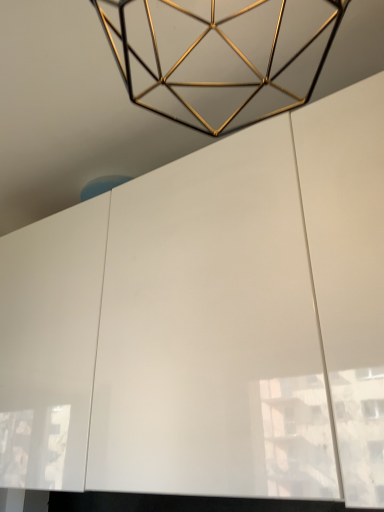
Image resolution: width=384 pixels, height=512 pixels. In order to click on gold wireframe lamp at upper center in this screenshot , I will do `click(220, 56)`.

Image resolution: width=384 pixels, height=512 pixels. Describe the element at coordinates (220, 56) in the screenshot. I see `gold wireframe lamp at upper center` at that location.

Measure the distance between gold wireframe lamp at upper center and camera.

gold wireframe lamp at upper center and camera are 28.75 inches apart.

Find the location of `gold wireframe lamp at upper center`. gold wireframe lamp at upper center is located at coordinates (220, 56).